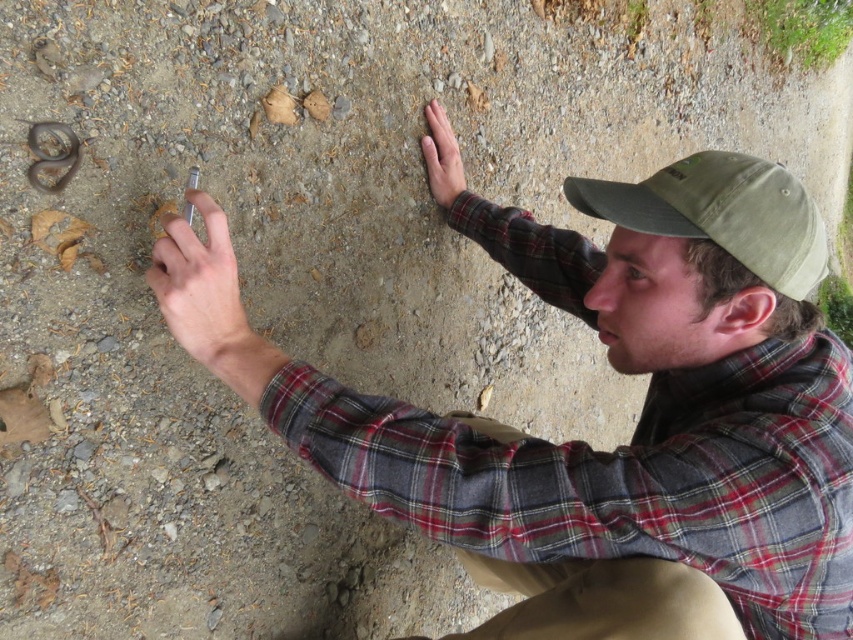
You are a photographer trying to capture the person in the scene. The person is crouched on a gravelly surface, examining something on the ground with their right hand and holding a small tool in their left. You need to focus your camera on the point at coordinates (628, 477). According to the image description, where exactly is this point located?

The point at coordinates (628, 477) is on the plaid fabric at center.